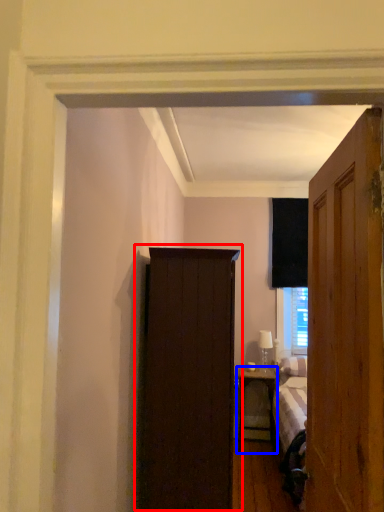
Question: Which object is closer to the camera taking this photo, cupboard (highlighted by a red box) or nightstand (highlighted by a blue box)?

Choices:
 (A) cupboard
 (B) nightstand

Answer: (A)